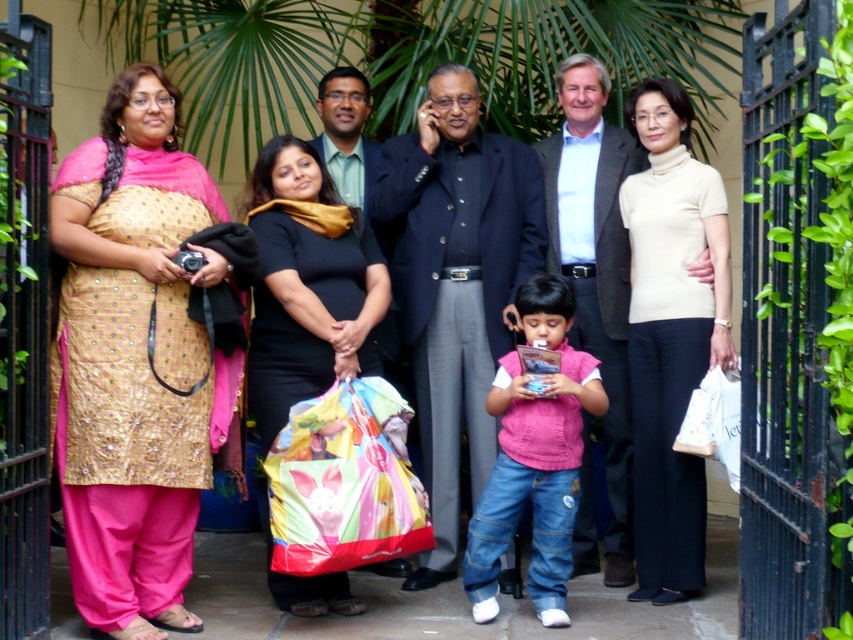
You are a photographer trying to capture a group photo of the gold sequined kurta at left and the green textured shirt at center. Which clothing item should you focus on first if you want to ensure both are in frame and properly aligned?

The gold sequined kurta at left is taller than the green textured shirt at center, so you should focus on the gold sequined kurta at left first to ensure proper alignment and framing.

You are a photographer trying to capture a clear shot of the dark blue suit at center and the multicolored plastic bag at center. Which object is blocking the view of the other?

The multicolored plastic bag at center is behind the dark blue suit at center, so the dark blue suit at center is blocking the view of the multicolored plastic bag at center.